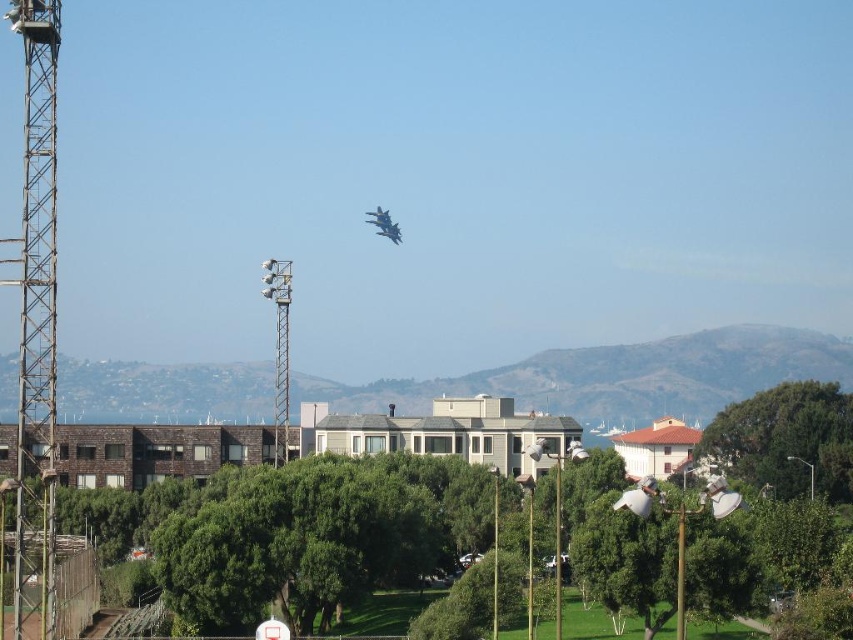
What is the 2D coordinate of the green leafy tree at center in the image?

The green leafy tree at center is located at the 2D coordinate point of (289,525).